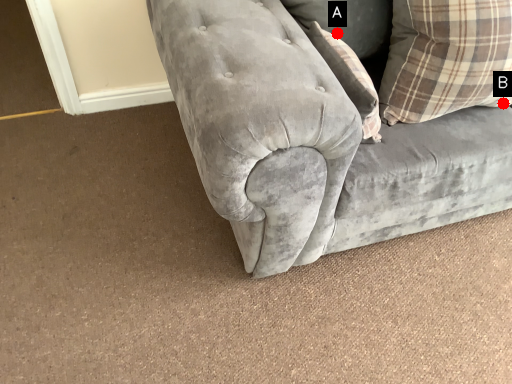
Question: Two points are circled on the image, labeled by A and B beside each circle. Which of the following is the farthest from the observer?

Choices:
 (A) A is further
 (B) B is further

Answer: (B)